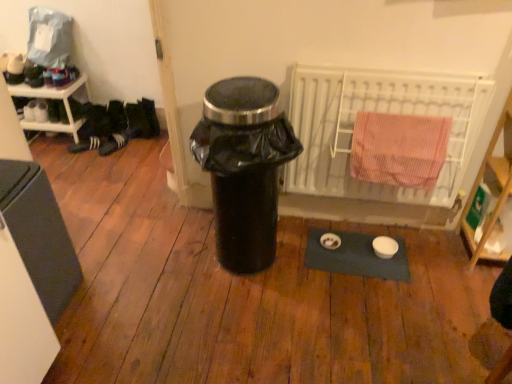
Find the location of a particular element. The height and width of the screenshot is (384, 512). free location in front of white textured shoe at left, which is the first shoe from right to left is located at coordinates coord(99,155).